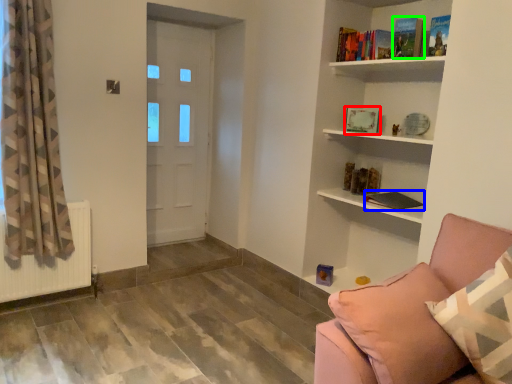
Question: Which object is the farthest from book (highlighted by a red box)? Choose among these: book (highlighted by a blue box) or book (highlighted by a green box).

Choices:
 (A) book
 (B) book

Answer: (B)